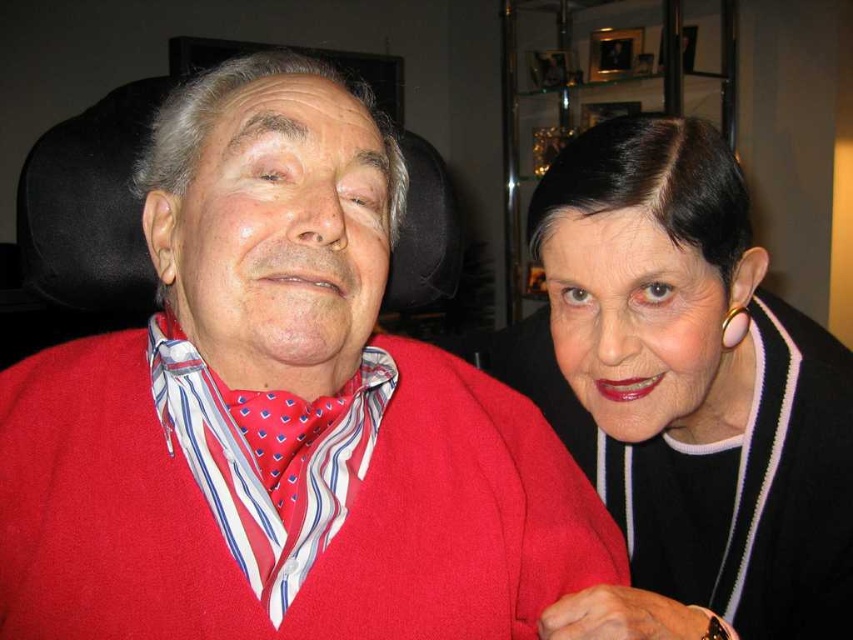
Can you confirm if matte red sweater at center is thinner than black matte sweater at upper right?

In fact, matte red sweater at center might be wider than black matte sweater at upper right.

Is point (204, 157) closer to viewer compared to point (587, 467)?

That is True.

Is point (279, 323) closer to camera compared to point (569, 307)?

Yes, it is in front of point (569, 307).

Locate an element on the screen. matte red sweater at center is located at coordinates (279, 413).